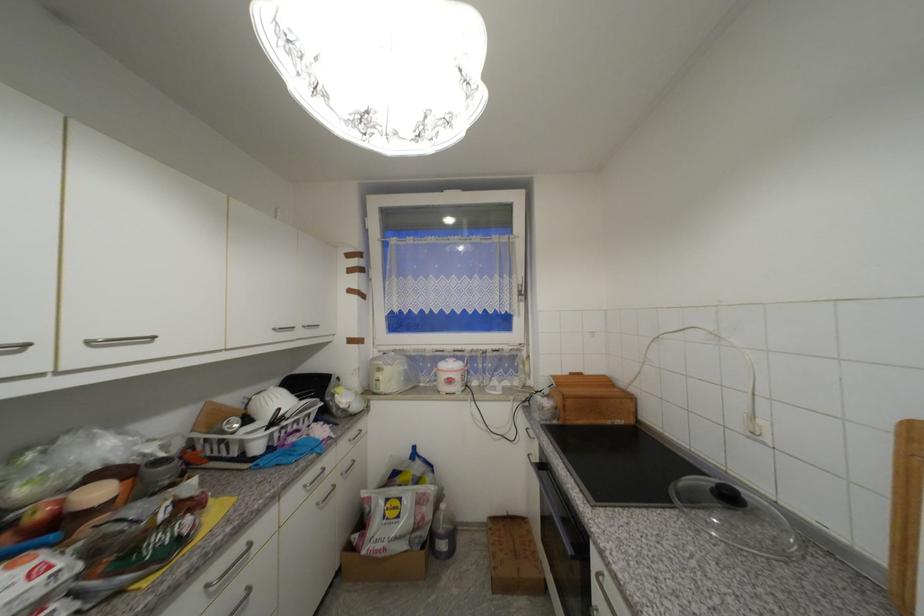
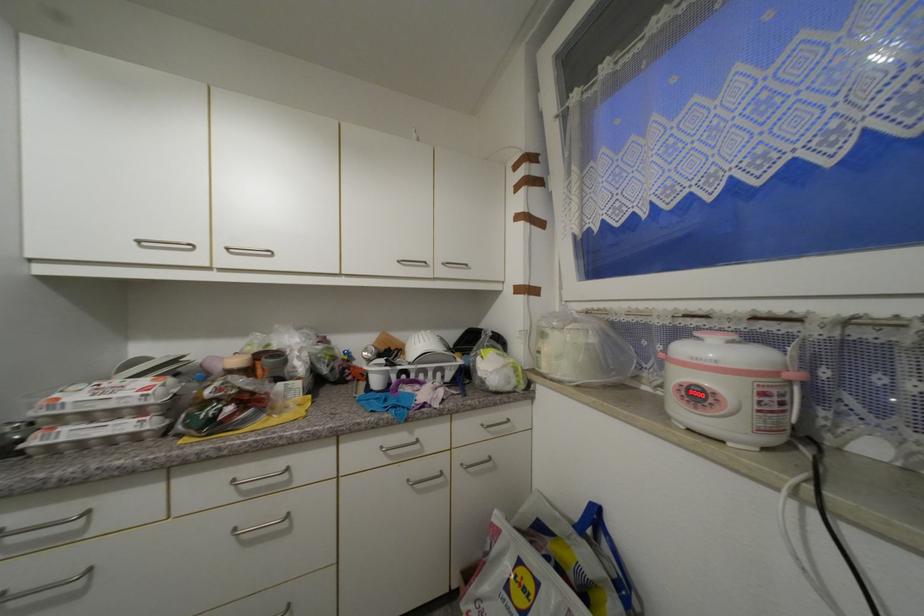
Where in the second image is the point corresponding to (x=213, y=588) from the first image?

(238, 483)